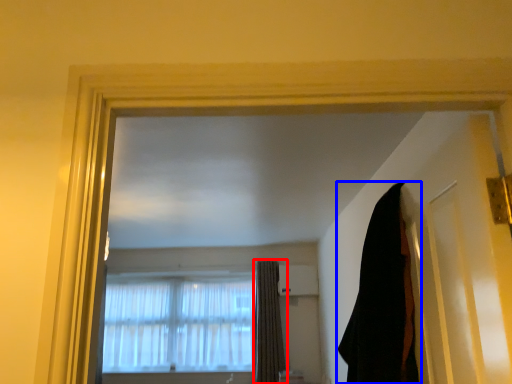
Question: Among these objects, which one is farthest to the camera, curtain (highlighted by a red box) or curtain (highlighted by a blue box)?

Choices:
 (A) curtain
 (B) curtain

Answer: (A)